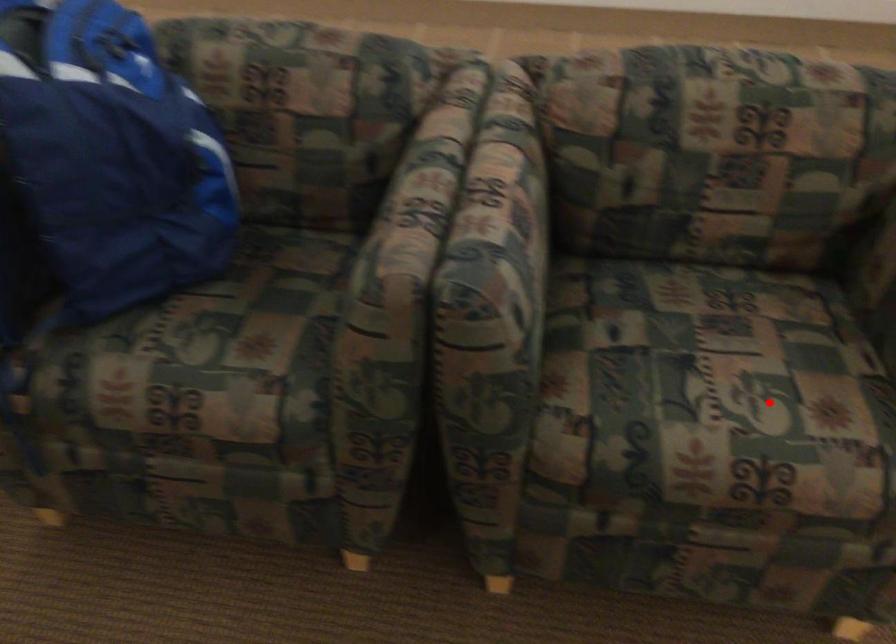
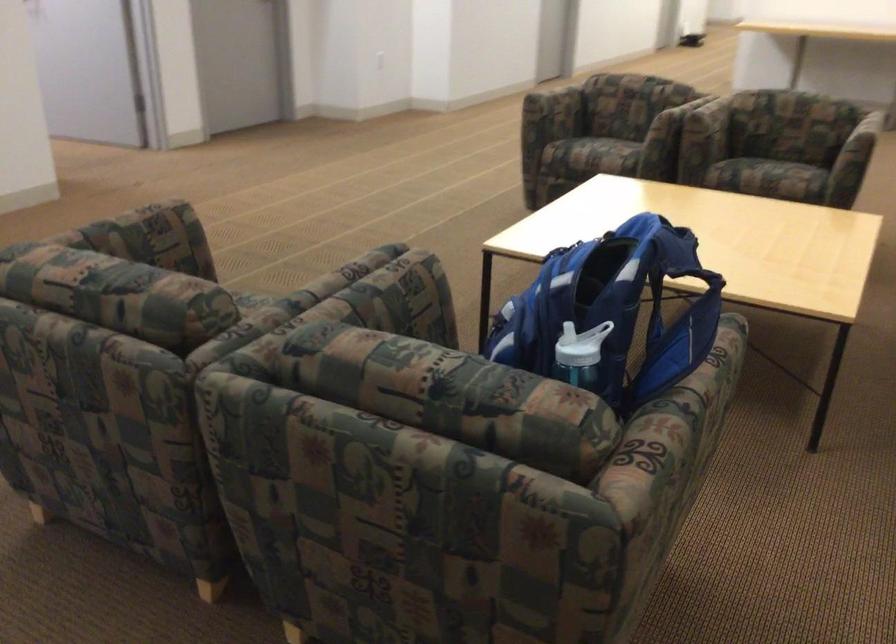
Question: I am providing you with two images of the same scene from different viewpoints. Given a red point in image1, look at the same physical point in image2. Is it:

Choices:
 (A) Closer to the viewpoint
 (B) Farther from the viewpoint

Answer: (B)